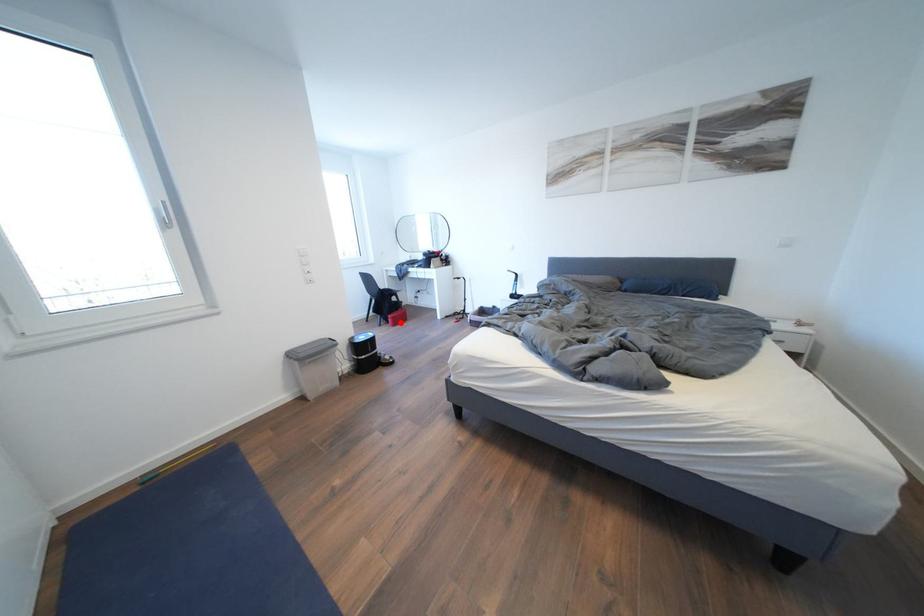
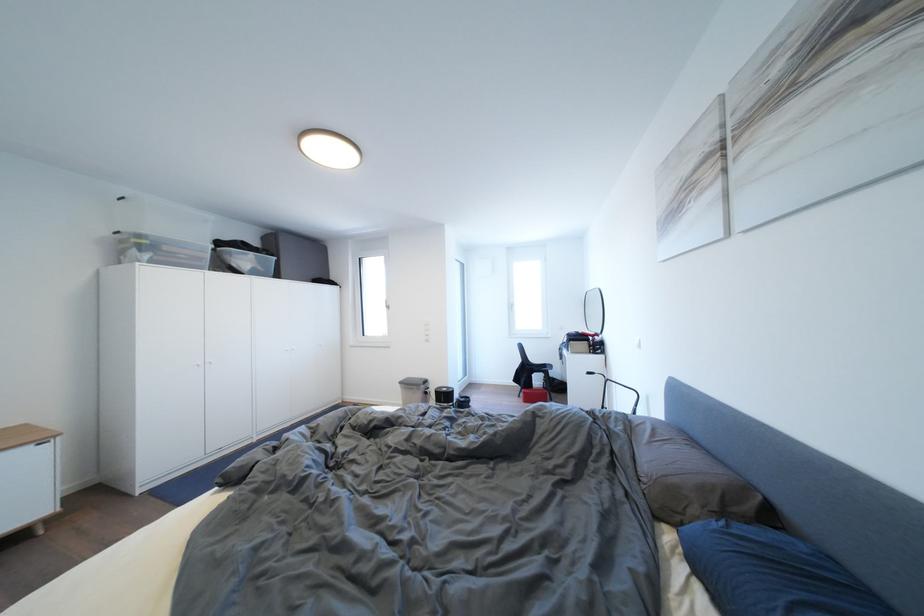
Question: I am providing you with two images of the same scene from different viewpoints. Image1 has a red point marked. In image2, the corresponding 3D location appears at what relative position? Reply with the corresponding letter.

Choices:
 (A) Closer
 (B) Farther

Answer: (B)